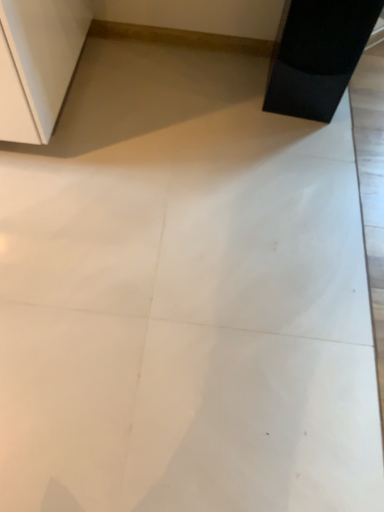
What are the coordinates of `spots to the right of glossy black speaker at upper right` in the screenshot? It's located at (359, 98).